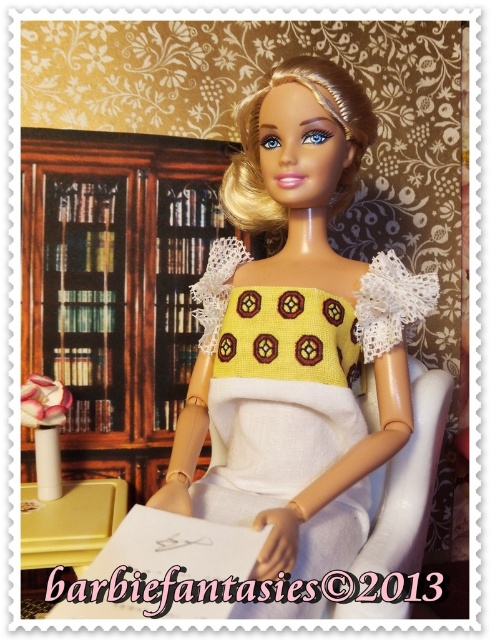
Is yellow crochet dress at center shorter than white fabric chair at center?

No.

From the picture: Who is higher up, yellow crochet dress at center or white fabric chair at center?

yellow crochet dress at center is higher up.

Find the location of a particular element. This screenshot has height=640, width=490. yellow crochet dress at center is located at coordinates (295, 337).

Locate an element on the screen. yellow crochet dress at center is located at coordinates (295, 337).

Between yellow crochet dress at center and woodenmaterial/texturebookshelf at left, which one has less height?

With less height is yellow crochet dress at center.

Based on the photo, between yellow crochet dress at center and woodenmaterial/texturebookshelf at left, which one appears on the right side from the viewer's perspective?

From the viewer's perspective, yellow crochet dress at center appears more on the right side.

Between point (390, 307) and point (220, 227), which one is positioned in front?

Point (390, 307) is more forward.

Locate an element on the screen. The height and width of the screenshot is (640, 490). yellow crochet dress at center is located at coordinates (295, 337).

Can you confirm if woodenmaterial/texturebookshelf at left is positioned to the right of yellow knitted dress at center?

No, woodenmaterial/texturebookshelf at left is not to the right of yellow knitted dress at center.

From the picture: Does woodenmaterial/texturebookshelf at left appear over yellow knitted dress at center?

Indeed, woodenmaterial/texturebookshelf at left is positioned over yellow knitted dress at center.

I want to click on woodenmaterial/texturebookshelf at left, so click(117, 285).

Find the location of a particular element. This screenshot has height=640, width=490. woodenmaterial/texturebookshelf at left is located at coordinates (117, 285).